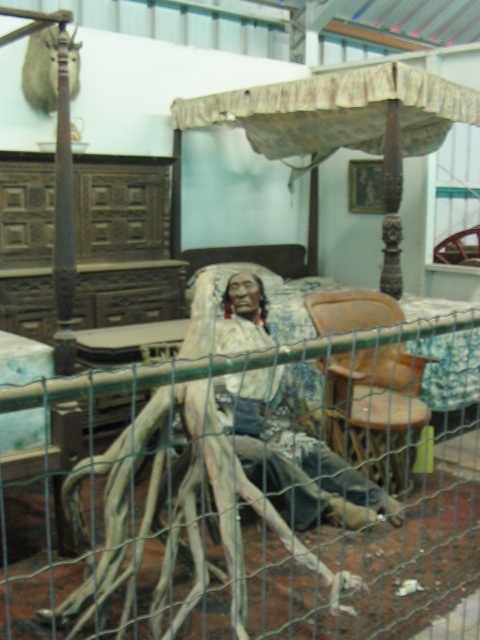
You are a visitor at the museum and want to sit on the brown leather chair at center. Can you approach the chair directly from the front without going around the green wire mesh at center?

The green wire mesh at center is in front of the brown leather chair at center, so you cannot approach the chair directly from the front without going around the green wire mesh at center.

You are a visitor in the museum and want to take a photo of the matte brown wooden mannequin at center without any obstructions. Is the green wire mesh at center blocking your view?

The green wire mesh at center is larger in size than the matte brown wooden mannequin at center, so it might block your view of the mannequin depending on their positions.